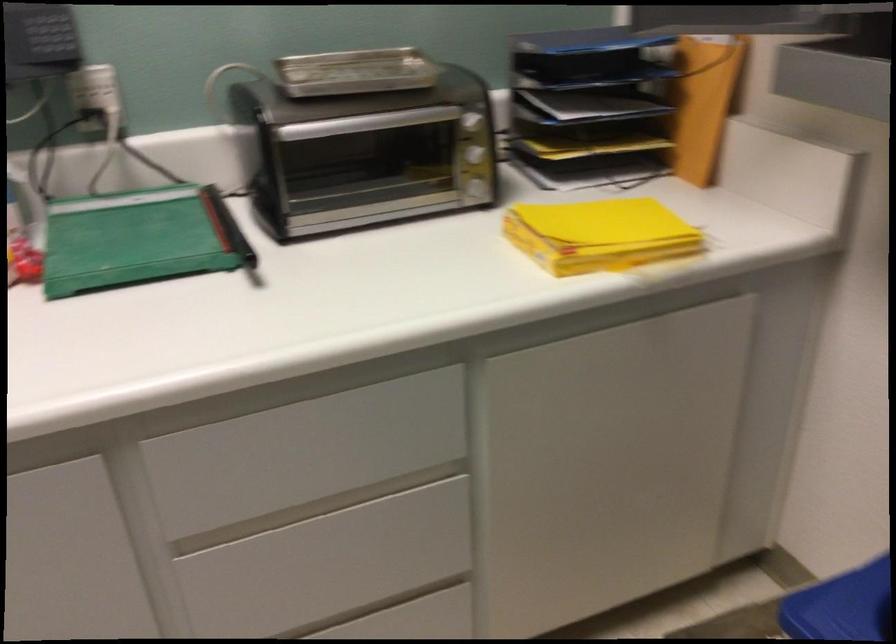
Where would you pull the toaster oven handle? Please return your answer as a coordinate pair (x, y).

(366, 122)